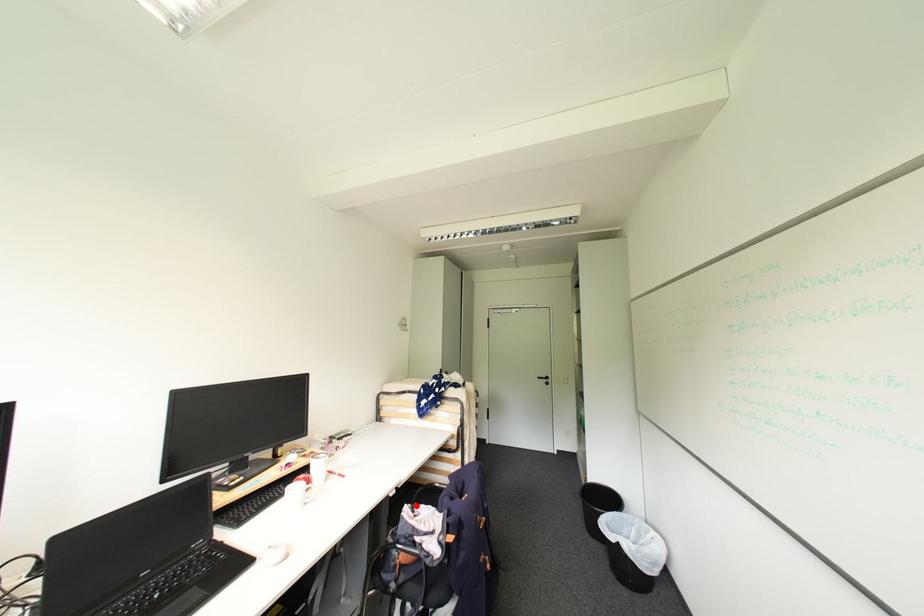
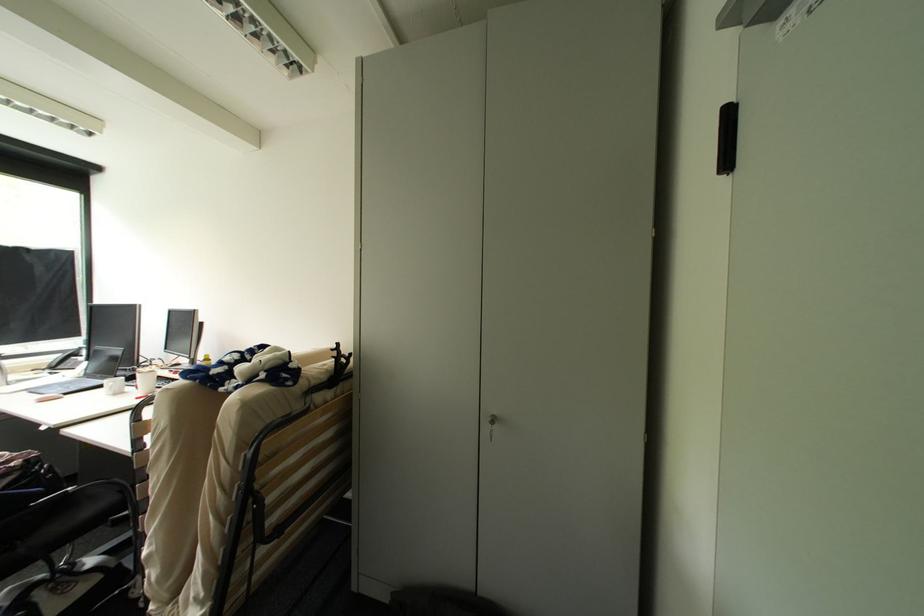
Question: I am providing you with two images of the same scene from different viewpoints. A red point is marked on the first image. Is the red point's position out of view in image 2?

Choices:
 (A) Yes
 (B) No

Answer: (A)